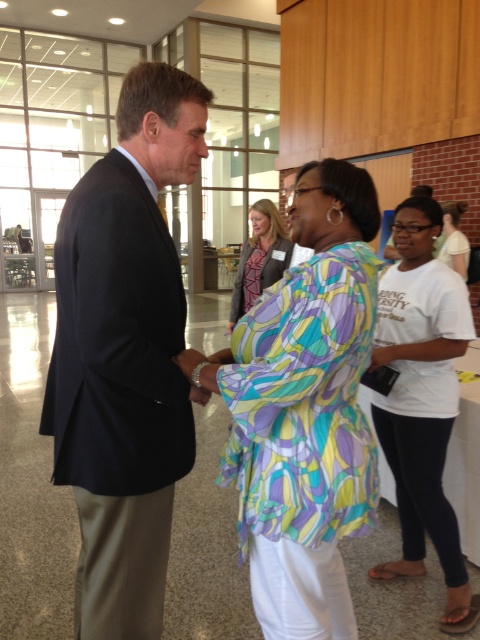
You are a photographer positioned at the entrance of the room. You want to capture a photo that includes both the black suit at left and the multicolored fabric blouse at center. Given that your camera has a maximum focus range of 12 inches, will you be able to focus on both subjects simultaneously?

The distance between the black suit at left and the multicolored fabric blouse at center is 12.27 inches. Since the camera can only focus within 12 inches, the subjects are slightly out of the focus range. Therefore, you cannot focus on both simultaneously.

You are organizing a photo shoot and need to place a 1.2 meter wide backdrop behind the black suit at left and the printed fabric blouse at center. Given their sizes, which object requires more space between them to ensure both are fully visible in the photo?

The black suit at left requires more space between them because it has a larger size compared to the printed fabric blouse at center, so to ensure both are fully visible, more distance is needed between them.